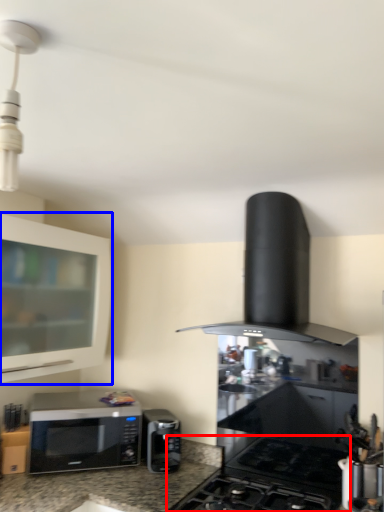
Question: Which point is further to the camera, gas stove (highlighted by a red box) or cabinetry (highlighted by a blue box)?

Choices:
 (A) gas stove
 (B) cabinetry

Answer: (B)